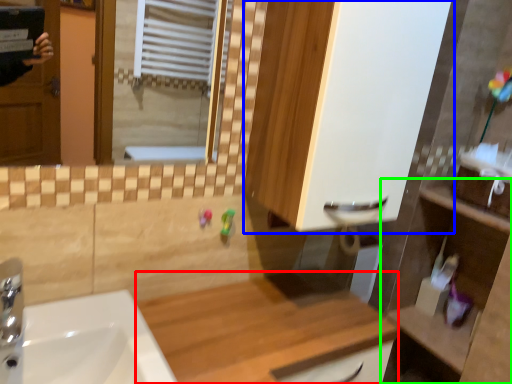
Question: Which object is positioned closest to counter top (highlighted by a red box)? Select from cabinetry (highlighted by a blue box) and counter (highlighted by a green box).

Choices:
 (A) cabinetry
 (B) counter

Answer: (B)